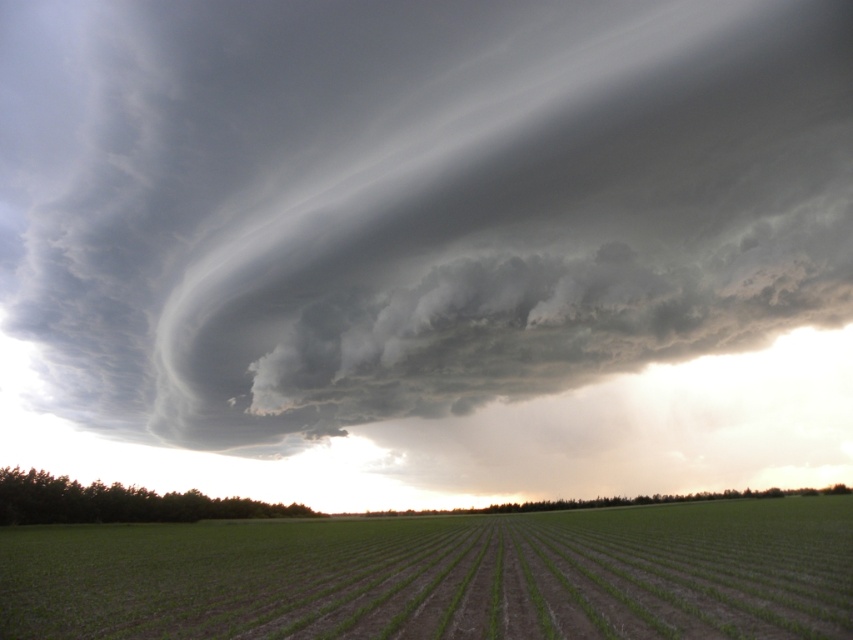
Can you confirm if dark gray cloud at upper center is positioned below green grass at center?

No, dark gray cloud at upper center is not below green grass at center.

Who is shorter, dark gray cloud at upper center or green grass at center?

With less height is green grass at center.

Which is in front, point (811, 241) or point (199, 572)?

Point (199, 572) is more forward.

Image resolution: width=853 pixels, height=640 pixels. Identify the location of dark gray cloud at upper center. (416, 204).